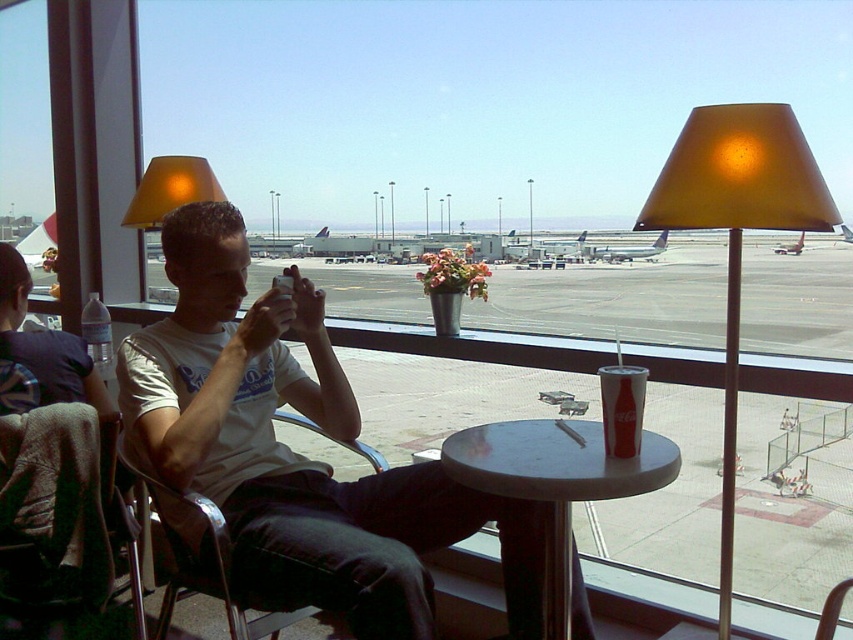
Is concrete tarmac at center to the right of matte gold lampshade at right from the viewer's perspective?

Indeed, concrete tarmac at center is positioned on the right side of matte gold lampshade at right.

Who is more distant from viewer, (851, 301) or (689, 218)?

The point (851, 301) is behind.

Locate an element on the screen. The height and width of the screenshot is (640, 853). concrete tarmac at center is located at coordinates (611, 301).

Who is positioned more to the right, white cotton shirt at center or metallic silver chair at left?

white cotton shirt at center is more to the right.

Which is more to the left, white cotton shirt at center or metallic silver chair at left?

metallic silver chair at left is more to the left.

Locate an element on the screen. This screenshot has height=640, width=853. white cotton shirt at center is located at coordinates (x=296, y=452).

This screenshot has width=853, height=640. What are the coordinates of `white cotton shirt at center` in the screenshot? It's located at (296, 452).

Does point (521, 426) lie in front of point (216, 198)?

Yes, point (521, 426) is closer to viewer.

Is smooth gray table at center bigger than matte yellow lampshade at upper left?

Incorrect, smooth gray table at center is not larger than matte yellow lampshade at upper left.

Does point (527, 435) come in front of point (149, 168)?

Yes, it is.

Find the location of a particular element. smooth gray table at center is located at coordinates (555, 483).